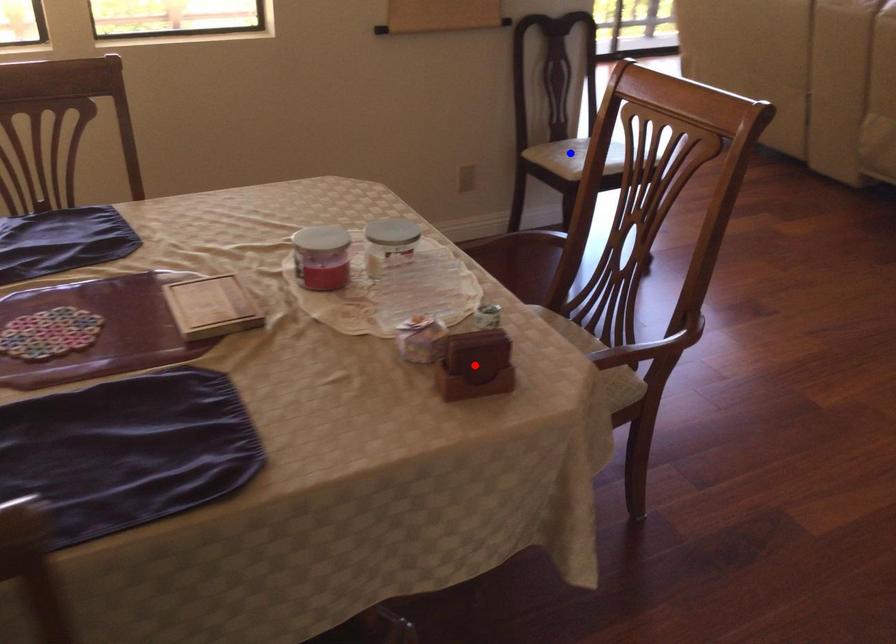
Question: Two points are marked on the image. Which point is closer to the camera?

Choices:
 (A) Blue point is closer.
 (B) Red point is closer.

Answer: (B)